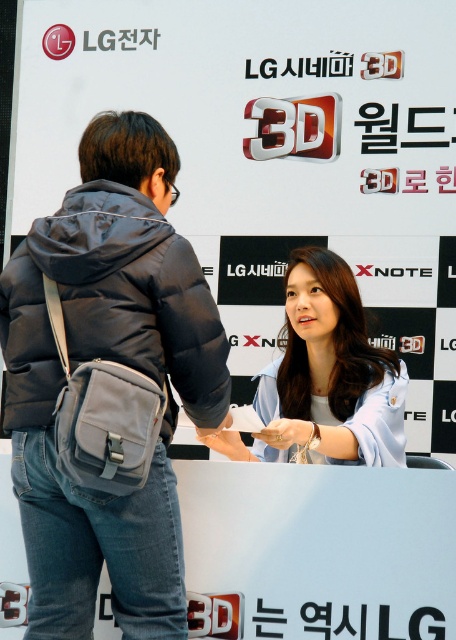
You are at an LG 3D event and notice two items at center. Which one is taller, the denim jacket at center or the white matte hand at center?

The denim jacket at center is taller than the white matte hand at center according to the description.

In the scene shown: You are attending an LG 3D event and notice two items at the counter. The denim jacket at center and the satin white wristband at lower center. Which item takes up more space on the counter?

The denim jacket at center takes up more space on the counter as it has a larger size compared to the satin white wristband at lower center.

What is located at the point with coordinates (102, 365) in the image?

The point at coordinates (102, 365) is located on the denim jacket at center.